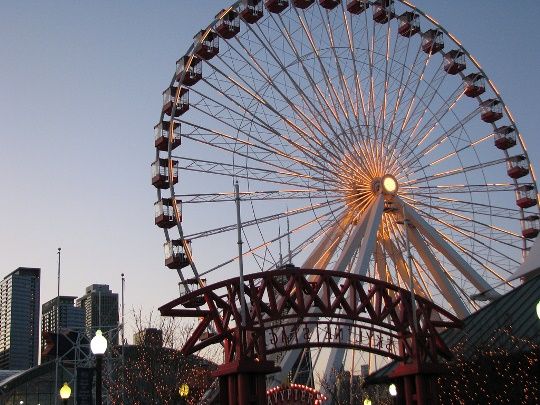
Find the location of a particular element. The width and height of the screenshot is (540, 405). yellow collored light is located at coordinates (67, 390), (182, 388), (366, 401).